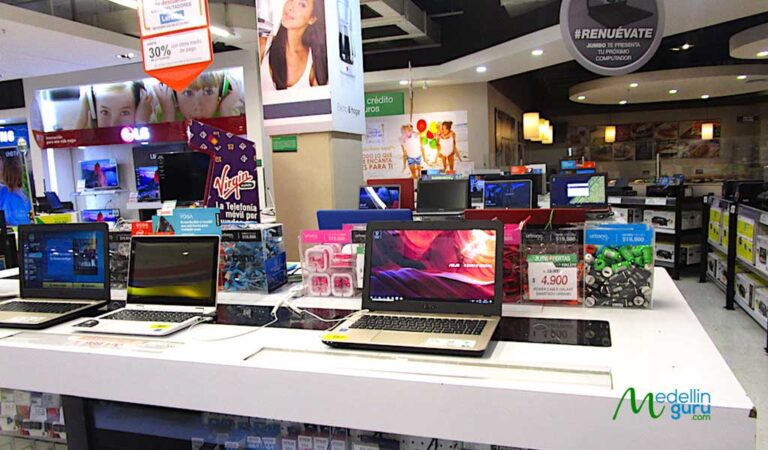
The image size is (768, 450). Identify the location of laptop. (151, 329).